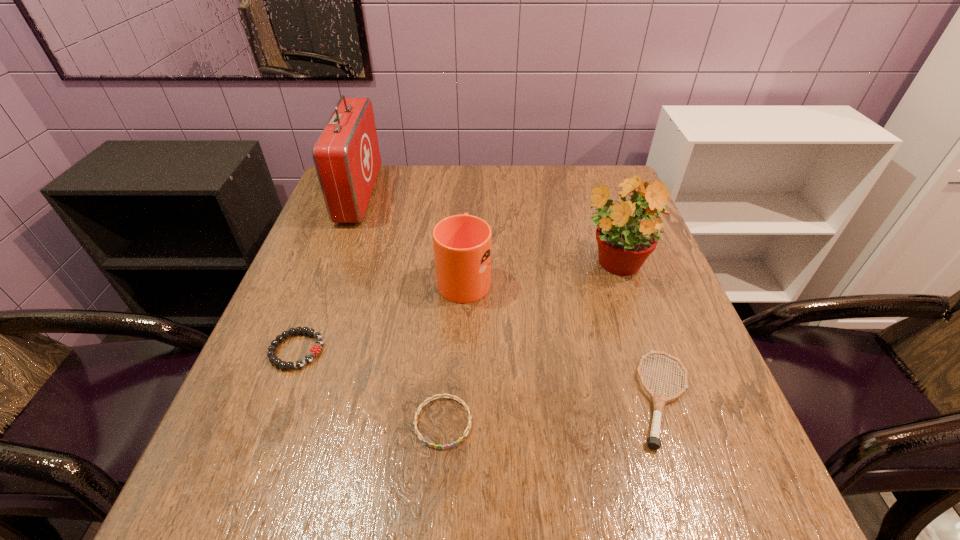
Identify which object is the fifth closest to the flowerpot. Please provide its 2D coordinates. Your answer should be formatted as a tuple, i.e. [(x, y)], where the tuple contains the x and y coordinates of a point satisfying the conditions above.

[(315, 350)]

Image resolution: width=960 pixels, height=540 pixels. What are the coordinates of `free location that satisfies the following two spatial constraints: 1. on the side of the first-aid kit with the first aid cross symbol; 2. on the handle side of the mug` in the screenshot? It's located at (330, 276).

I want to click on free location that satisfies the following two spatial constraints: 1. on the side of the farthest object with the first aid cross symbol; 2. on the left side of the third shortest object, so click(x=285, y=399).

The image size is (960, 540). In order to click on vacant space that satisfies the following two spatial constraints: 1. on the side of the tennis racket with the first aid cross symbol; 2. on the left side of the farthest object in this screenshot , I will do `click(285, 399)`.

Image resolution: width=960 pixels, height=540 pixels. I want to click on free space that satisfies the following two spatial constraints: 1. on the side of the flowerpot with the first aid cross symbol; 2. on the right side of the farthest object, so click(334, 265).

This screenshot has height=540, width=960. Find the location of `free space that satisfies the following two spatial constraints: 1. on the side of the first-aid kit with the first aid cross symbol; 2. on the left side of the third shortest object`. free space that satisfies the following two spatial constraints: 1. on the side of the first-aid kit with the first aid cross symbol; 2. on the left side of the third shortest object is located at coordinates (285, 399).

Identify the location of vacant area that satisfies the following two spatial constraints: 1. on the side of the farthest object with the first aid cross symbol; 2. on the handle side of the mug. (330, 276).

The height and width of the screenshot is (540, 960). Find the location of `free space that satisfies the following two spatial constraints: 1. on the side of the first-aid kit with the first aid cross symbol; 2. on the handle side of the mug`. free space that satisfies the following two spatial constraints: 1. on the side of the first-aid kit with the first aid cross symbol; 2. on the handle side of the mug is located at coordinates (330, 276).

Find the location of `blank area in the image that satisfies the following two spatial constraints: 1. on the side of the first-aid kit with the first aid cross symbol; 2. on the back side of the third shortest object`. blank area in the image that satisfies the following two spatial constraints: 1. on the side of the first-aid kit with the first aid cross symbol; 2. on the back side of the third shortest object is located at coordinates (285, 399).